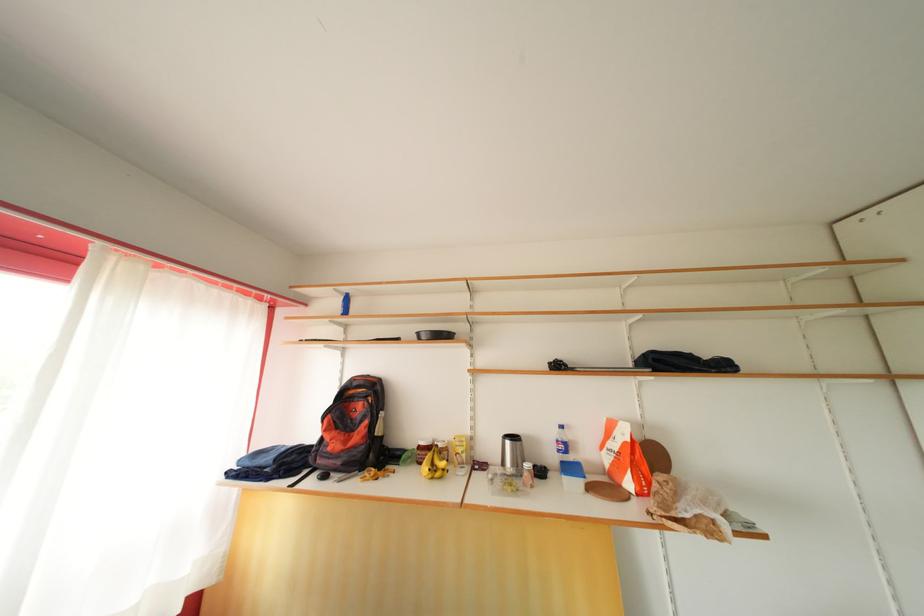
Find where to lift the yellow banana. Please return your answer as a coordinate pair (x, y).

(433, 464)